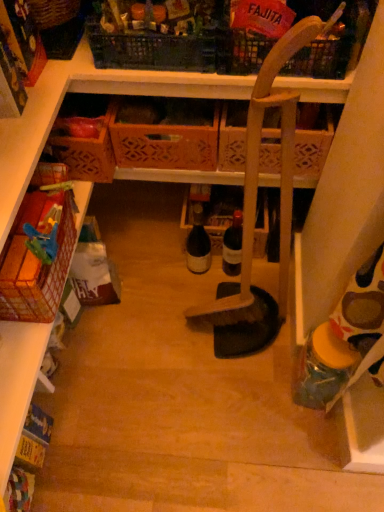
Question: Is matte glass bottle at center, which appears as the second bottle when ordered from the bottom, behind wooden crate at center, the 5th basket positioned from the top?

Choices:
 (A) yes
 (B) no

Answer: (A)

Question: Considering the relative sizes of matte glass bottle at center, the 2th bottle when ordered from front to back, and wooden crate at center, which appears as the 2th basket when ordered from the bottom, in the image provided, is matte glass bottle at center, the 2th bottle when ordered from front to back, thinner than wooden crate at center, which appears as the 2th basket when ordered from the bottom,?

Choices:
 (A) yes
 (B) no

Answer: (A)

Question: Is matte glass bottle at center, the 2th bottle when ordered from front to back, in contact with wooden crate at center, which appears as the 2th basket when ordered from the bottom?

Choices:
 (A) no
 (B) yes

Answer: (A)

Question: Can you confirm if matte glass bottle at center, which appears as the second bottle when ordered from the bottom, is positioned to the right of wooden crate at center, which appears as the 2th basket when ordered from the bottom?

Choices:
 (A) no
 (B) yes

Answer: (B)

Question: Is matte glass bottle at center, which appears as the second bottle when ordered from the bottom, aimed at wooden crate at center, the 5th basket positioned from the top?

Choices:
 (A) no
 (B) yes

Answer: (A)

Question: Looking at their shapes, would you say wooden crate at center, the 5th basket positioned from the top, is wider or thinner than plastic crate at upper center, marked as the fourth basket in a bottom-to-top arrangement?

Choices:
 (A) wide
 (B) thin

Answer: (A)

Question: From the image's perspective, relative to plastic crate at upper center, which is the third basket from top to bottom, is wooden crate at center, the 5th basket positioned from the top, above or below?

Choices:
 (A) above
 (B) below

Answer: (B)

Question: In terms of height, does wooden crate at center, which appears as the 2th basket when ordered from the bottom, look taller or shorter compared to plastic crate at upper center, which is the third basket from top to bottom?

Choices:
 (A) tall
 (B) short

Answer: (A)

Question: Considering the positions of point (110, 174) and point (140, 48), is point (110, 174) closer or farther from the camera than point (140, 48)?

Choices:
 (A) farther
 (B) closer

Answer: (A)

Question: Considering the relative positions of wooden crate at center, the 5th basket positioned from the top, and wooden broom at center in the image provided, is wooden crate at center, the 5th basket positioned from the top, to the left or to the right of wooden broom at center?

Choices:
 (A) left
 (B) right

Answer: (A)

Question: Is point (69, 158) closer or farther from the camera than point (296, 47)?

Choices:
 (A) closer
 (B) farther

Answer: (B)

Question: In terms of size, does wooden crate at center, the 5th basket positioned from the top, appear bigger or smaller than wooden broom at center?

Choices:
 (A) small
 (B) big

Answer: (A)

Question: In the image, is wooden crate at center, which appears as the 2th basket when ordered from the bottom, positioned in front of or behind wooden broom at center?

Choices:
 (A) front
 (B) behind

Answer: (B)

Question: From a real-world perspective, is translucent plastic jar at lower right, which is the first bottle in right-to-left order, positioned above or below plastic crate at upper center, marked as the fourth basket in a bottom-to-top arrangement?

Choices:
 (A) below
 (B) above

Answer: (A)

Question: Is translucent plastic jar at lower right, positioned as the first bottle in front-to-back order, inside the boundaries of plastic crate at upper center, which is the third basket from top to bottom, or outside?

Choices:
 (A) inside
 (B) outside

Answer: (B)